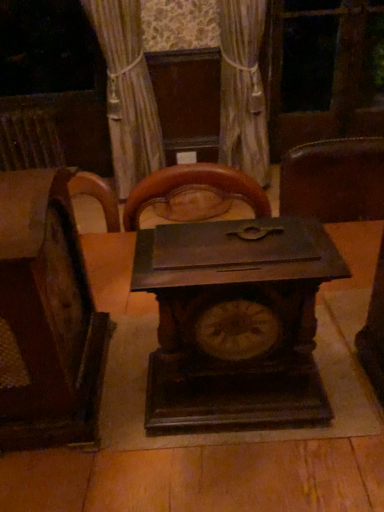
Identify the location of vacant point to the right of wooden chair at left. Image resolution: width=384 pixels, height=512 pixels. (144, 396).